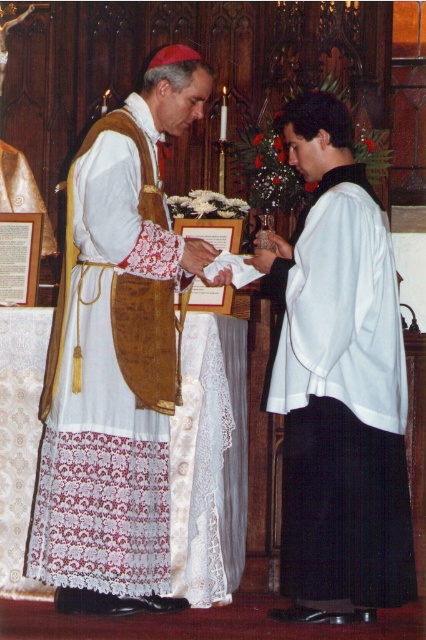
Is matte gold vestment at center behind white satin robe at center?

That is False.

Does matte gold vestment at center appear on the left side of white satin robe at center?

→ Correct, you'll find matte gold vestment at center to the left of white satin robe at center.

Is point (161, 326) farther from camera compared to point (325, 520)?

No, it is not.

Where is `matte gold vestment at center`? The width and height of the screenshot is (426, 640). matte gold vestment at center is located at coordinates (117, 358).